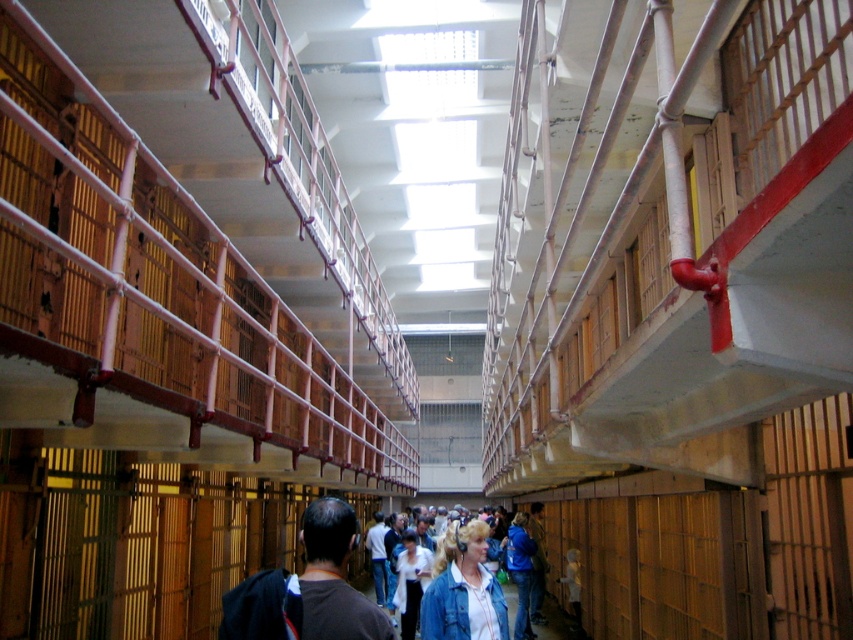
Question: Is dark brown hair at center bigger than denim jacket at center?

Choices:
 (A) yes
 (B) no

Answer: (B)

Question: Does rustic wood rail at center have a lesser width compared to denim jacket at center?

Choices:
 (A) yes
 (B) no

Answer: (A)

Question: Which point is closer to the camera?

Choices:
 (A) blue denim jacket at center
 (B) denim jacket at center
 (C) white shirt at center
 (D) rustic wood rail at center

Answer: (D)

Question: Based on their relative distances, which object is farther from the denim jacket at center?

Choices:
 (A) blue denim jacket at center
 (B) white shirt at center
 (C) dark brown hair at center

Answer: (C)

Question: Which object is closer to the camera taking this photo?

Choices:
 (A) denim jacket at lower center
 (B) rustic wood rail at center
 (C) dark brown hair at center

Answer: (C)

Question: Observing the image, what is the correct spatial positioning of white shirt at center in reference to blue denim jacket at center?

Choices:
 (A) left
 (B) right

Answer: (A)